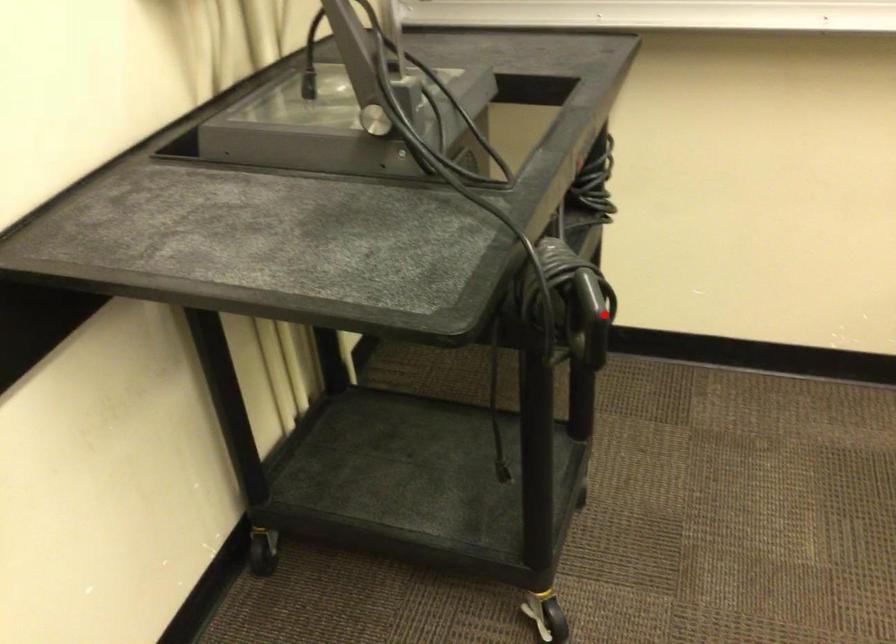
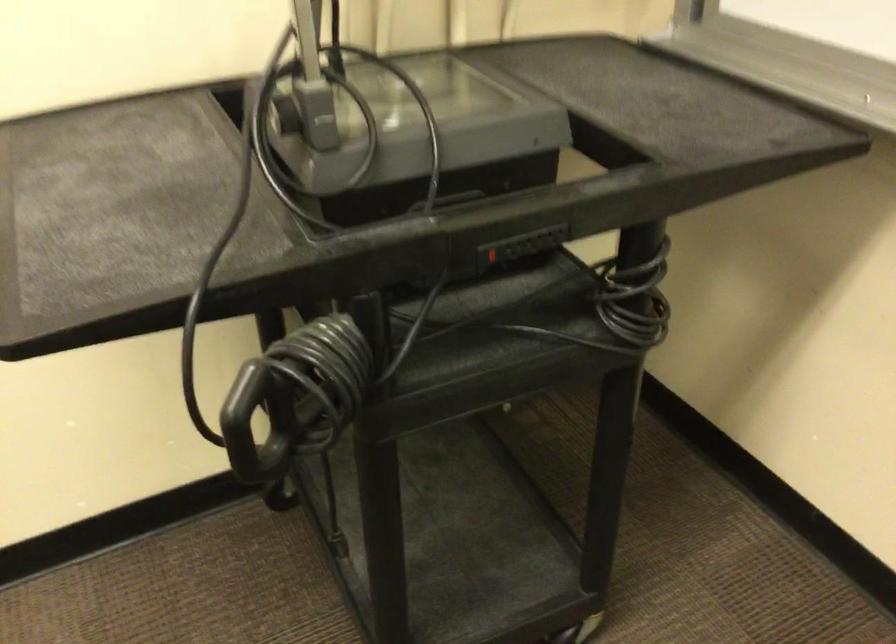
In the second image, find the point that corresponds to the highlighted location in the first image.

(247, 418)